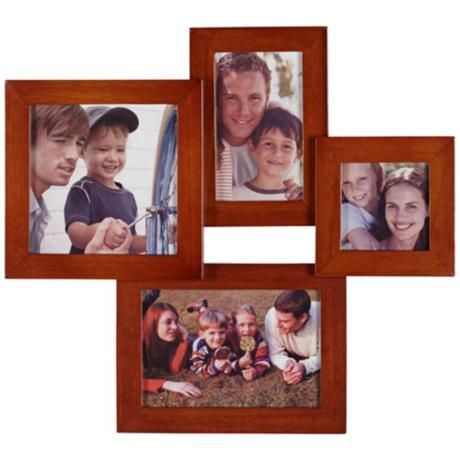
Locate an element on the screen. Image resolution: width=460 pixels, height=460 pixels. picture frame is located at coordinates (105, 89), (281, 40), (377, 149), (250, 275).